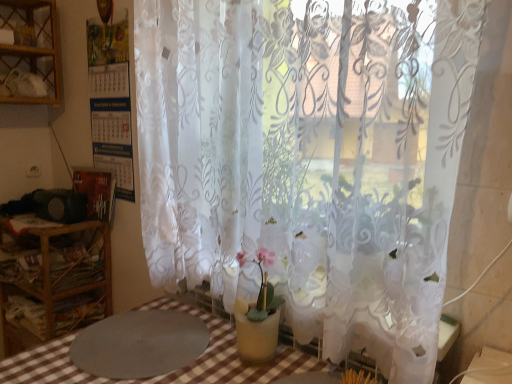
Question: Does transparent floral-patterned curtain at center have a lesser width compared to wooden shelf at left?

Choices:
 (A) yes
 (B) no

Answer: (A)

Question: Is transparent floral-patterned curtain at center closer to the viewer compared to wooden shelf at left?

Choices:
 (A) yes
 (B) no

Answer: (A)

Question: Does transparent floral-patterned curtain at center have a greater height compared to wooden shelf at left?

Choices:
 (A) yes
 (B) no

Answer: (A)

Question: Does transparent floral-patterned curtain at center turn towards wooden shelf at left?

Choices:
 (A) no
 (B) yes

Answer: (A)

Question: Is wooden shelf at left completely or partially inside transparent floral-patterned curtain at center?

Choices:
 (A) yes
 (B) no

Answer: (B)

Question: Considering the positions of point (154, 173) and point (99, 355), is point (154, 173) closer or farther from the camera than point (99, 355)?

Choices:
 (A) closer
 (B) farther

Answer: (B)

Question: In the image, is transparent floral-patterned curtain at center on the left side or the right side of gray textured mat at lower left?

Choices:
 (A) right
 (B) left

Answer: (A)

Question: Considering the positions of transparent floral-patterned curtain at center and gray textured mat at lower left in the image, is transparent floral-patterned curtain at center taller or shorter than gray textured mat at lower left?

Choices:
 (A) tall
 (B) short

Answer: (A)

Question: Looking at the image, does transparent floral-patterned curtain at center seem bigger or smaller compared to gray textured mat at lower left?

Choices:
 (A) big
 (B) small

Answer: (A)

Question: Considering the positions of gray textured mat at lower left and transparent floral-patterned curtain at center in the image, is gray textured mat at lower left bigger or smaller than transparent floral-patterned curtain at center?

Choices:
 (A) small
 (B) big

Answer: (A)

Question: Which is correct: gray textured mat at lower left is inside transparent floral-patterned curtain at center, or outside of it?

Choices:
 (A) inside
 (B) outside

Answer: (B)

Question: In terms of height, does gray textured mat at lower left look taller or shorter compared to transparent floral-patterned curtain at center?

Choices:
 (A) tall
 (B) short

Answer: (B)

Question: Considering their positions, is gray textured mat at lower left located in front of or behind transparent floral-patterned curtain at center?

Choices:
 (A) front
 (B) behind

Answer: (B)

Question: In the image, is wooden shelf at left on the left side or the right side of transparent floral-patterned curtain at center?

Choices:
 (A) left
 (B) right

Answer: (A)

Question: Looking at the image, does wooden shelf at left seem bigger or smaller compared to transparent floral-patterned curtain at center?

Choices:
 (A) big
 (B) small

Answer: (B)